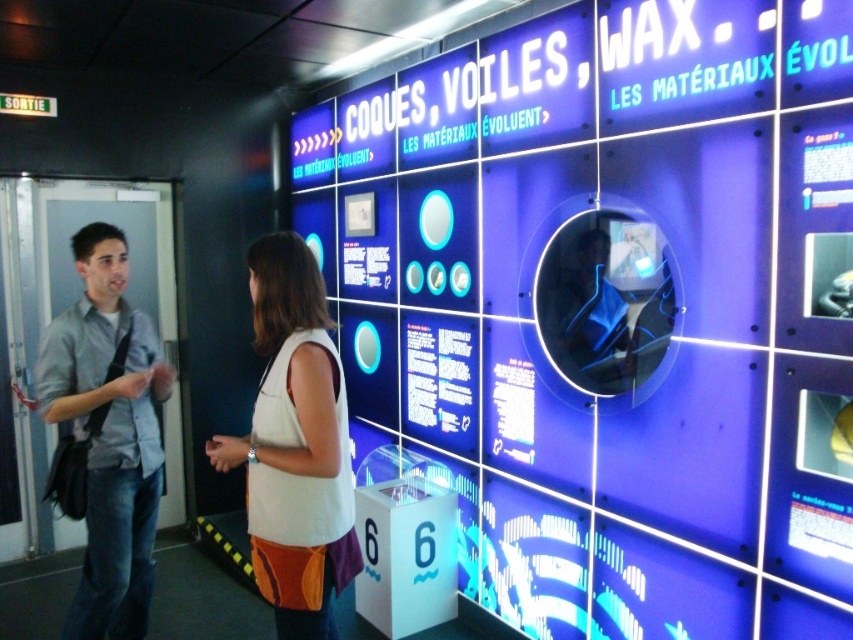
Can you confirm if white fabric dress at center is taller than light blue shirt at left?

No, white fabric dress at center is not taller than light blue shirt at left.

Is white fabric dress at center in front of light blue shirt at left?

That is True.

Where is `white fabric dress at center`? white fabric dress at center is located at coordinates 294,444.